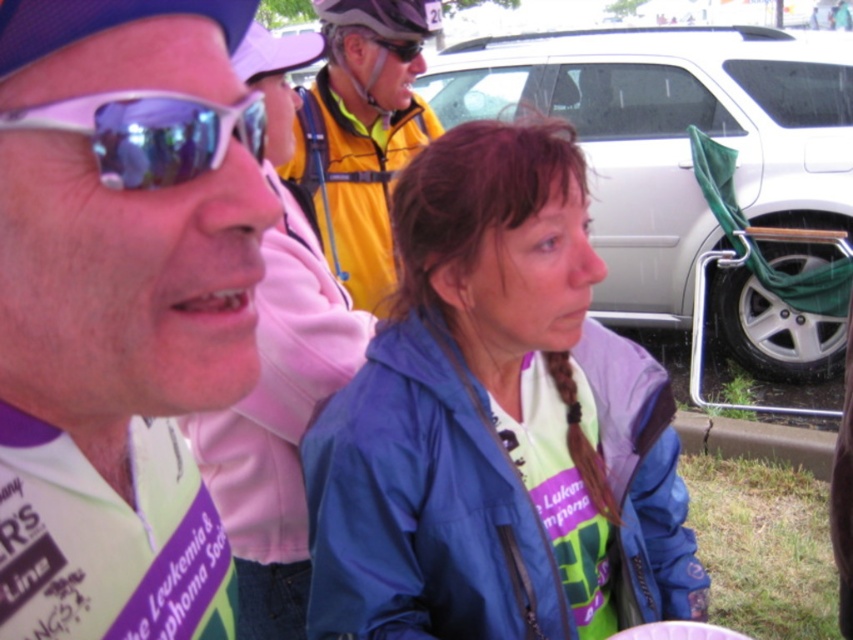
Between purple fabric at left and white paper plate at center, which one appears on the left side from the viewer's perspective?

Positioned to the left is purple fabric at left.

Does purple fabric at left have a smaller size compared to white paper plate at center?

Incorrect, purple fabric at left is not smaller in size than white paper plate at center.

Identify the location of purple fabric at left. This screenshot has width=853, height=640. (122, 307).

Is shiny purple plastic sunglasses at upper left taller than shiny black helmet at upper center?

No, shiny purple plastic sunglasses at upper left is not taller than shiny black helmet at upper center.

Between shiny purple plastic sunglasses at upper left and shiny black helmet at upper center, which one has less height?

With less height is shiny purple plastic sunglasses at upper left.

Is point (178, 124) positioned after point (428, 12)?

No, it is in front of (428, 12).

I want to click on shiny purple plastic sunglasses at upper left, so click(x=149, y=132).

Does purple fabric at left have a lesser width compared to shiny black helmet at upper center?

Indeed, purple fabric at left has a lesser width compared to shiny black helmet at upper center.

Between point (1, 45) and point (346, 24), which one is positioned in front?

Point (1, 45) is more forward.

Which is in front, point (169, 339) or point (361, 19)?

Positioned in front is point (169, 339).

The width and height of the screenshot is (853, 640). Identify the location of purple fabric at left. (122, 307).